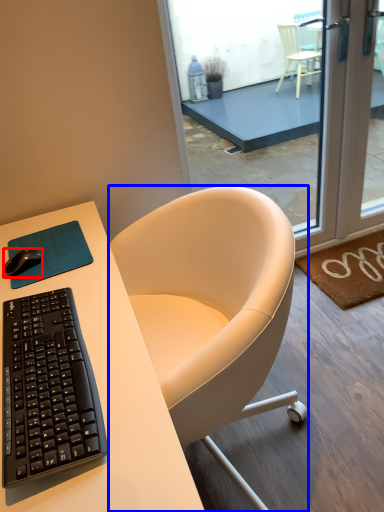
Question: Which object appears farthest to the camera in this image, desk mouse (highlighted by a red box) or chair (highlighted by a blue box)?

Choices:
 (A) desk mouse
 (B) chair

Answer: (B)